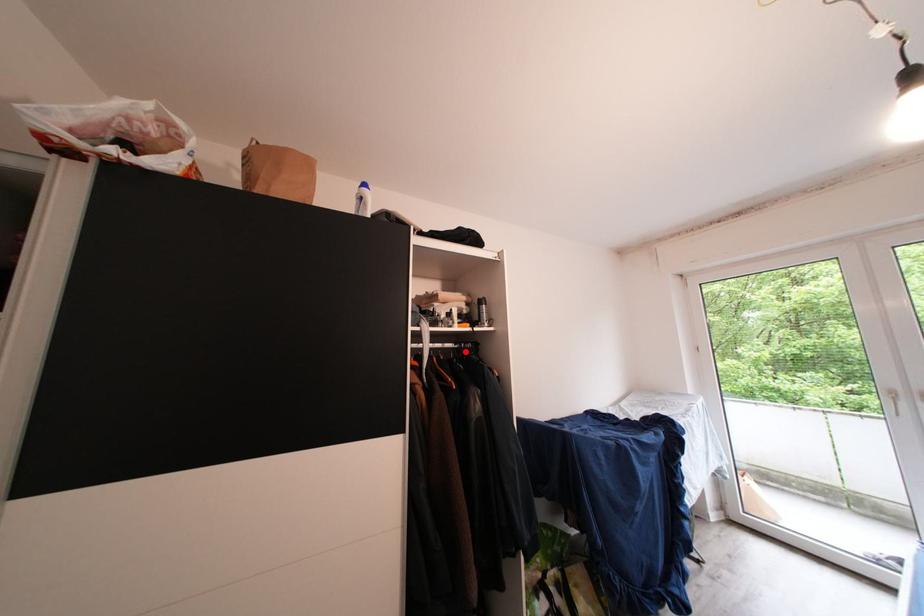
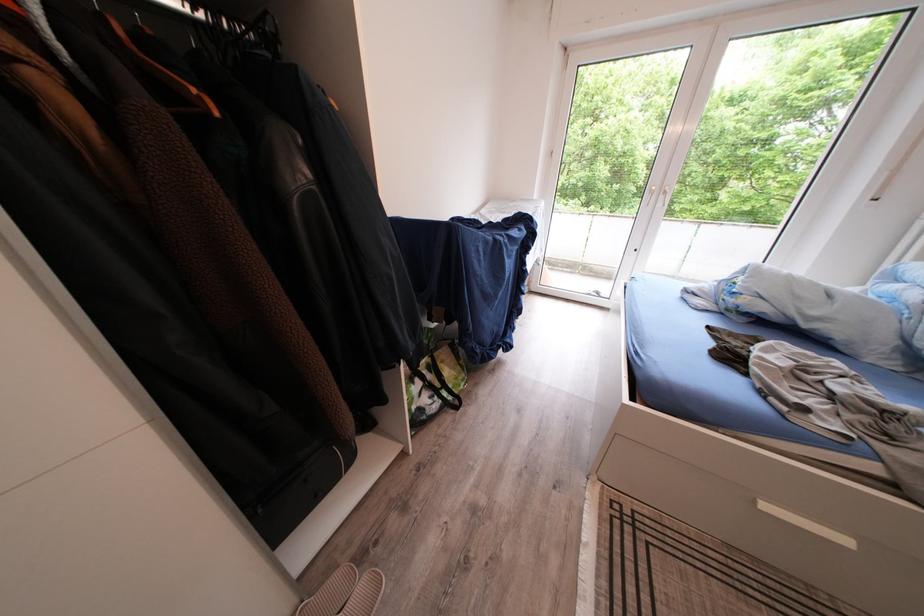
Question: I am providing you with two images of the same scene from different viewpoints. A red point is marked on the first image. At the location where the point appears in image 1, is it still visible in image 2?

Choices:
 (A) Yes
 (B) No

Answer: (A)